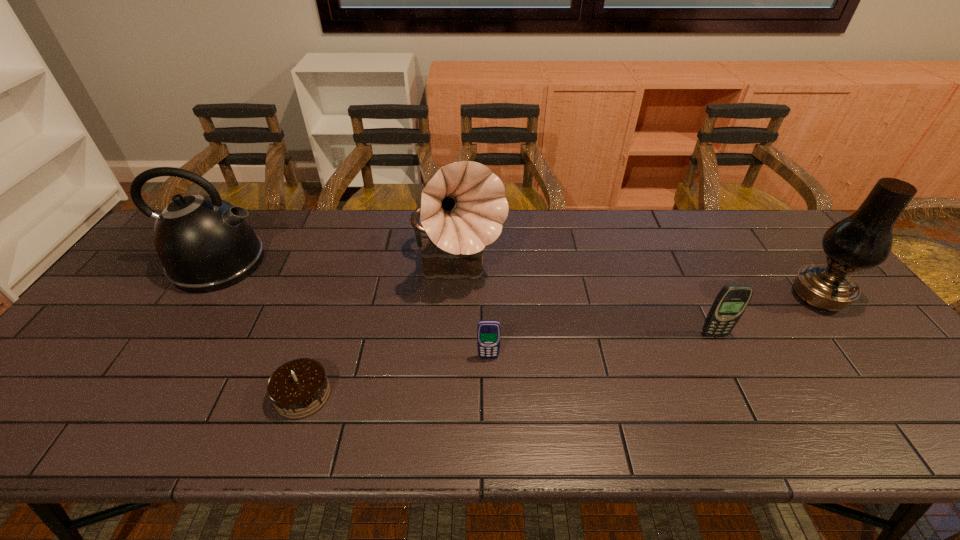
Locate an element on the screen. The width and height of the screenshot is (960, 540). record player is located at coordinates pos(463,207).

Where is `the rightmost object`? the rightmost object is located at coordinates (863, 240).

The image size is (960, 540). Identify the location of kettle. (206, 244).

Identify the location of the farther cellular telephone. This screenshot has height=540, width=960. (732, 300).

Locate an element on the screen. the fourth tallest object is located at coordinates (732, 300).

The image size is (960, 540). In order to click on the second nearest object in this screenshot , I will do `click(488, 331)`.

I want to click on the shorter cellular telephone, so click(488, 331).

Find the location of `the fifth object from right to left`. the fifth object from right to left is located at coordinates (299, 388).

The width and height of the screenshot is (960, 540). Identify the location of chocolate cake. (299, 388).

The width and height of the screenshot is (960, 540). What are the coordinates of `free space located 0.170m from the horn of the record player` in the screenshot? It's located at (453, 355).